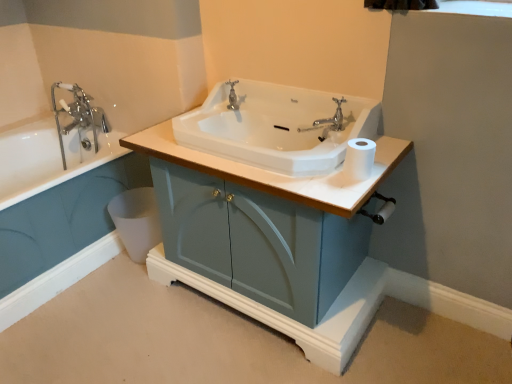
I want to click on free point in front of white plastic toilet bowl at lower left, so click(x=131, y=281).